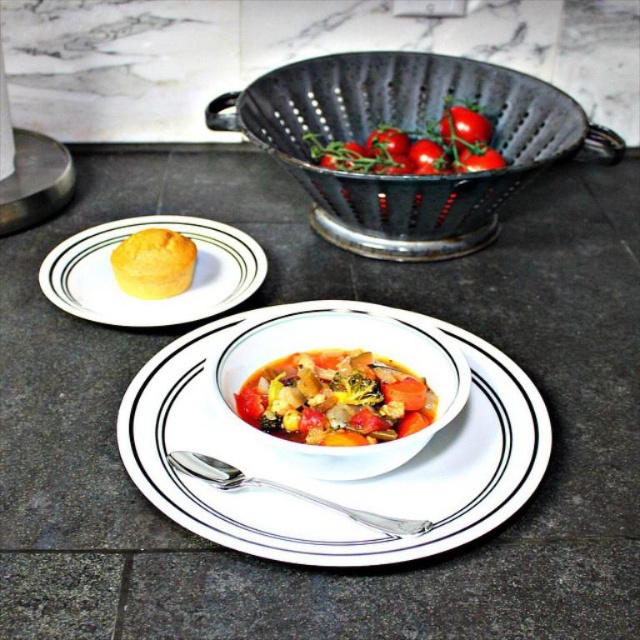
You are a person with an average arm length of 24 inches. You want to reach the vibrant mixed vegetable stew at center from where you are standing. Can you reach it?

The vibrant mixed vegetable stew at center is 24.24 inches away from the viewer. Since your arm length is 24 inches, you cannot reach it because the distance is slightly longer than your arm length.

What are the coordinates of the vibrant mixed vegetable stew at center?

The vibrant mixed vegetable stew at center is located at coordinates point (x=336, y=397).

You are a chef preparing to place a 6.5 inch long wooden spoon between the black metal colander at upper center and the glossy red tomato at upper center. Based on the space available, will the spoon fit between them?

The distance between the black metal colander at upper center and the glossy red tomato at upper center is 7.06 inches. Since the spoon is 6.5 inches long, it will fit between them with a small amount of space remaining.